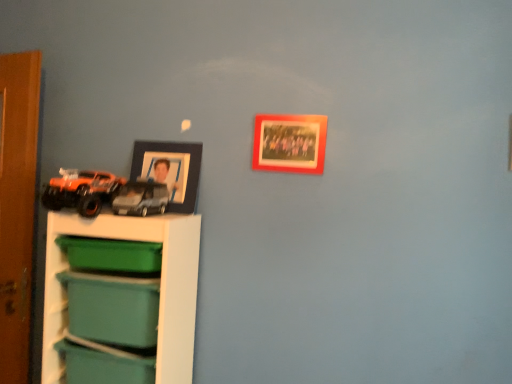
Question: From a real-world perspective, is teal plastic storage box at lower left, the 1th storage box ordered from the bottom, positioned over matte green plastic storage box at lower left, the 2th storage box when ordered from bottom to top, based on gravity?

Choices:
 (A) yes
 (B) no

Answer: (B)

Question: Is teal plastic storage box at lower left, which is counted as the third storage box, starting from the top, smaller than matte green plastic storage box at lower left, the 2th storage box positioned from the top?

Choices:
 (A) yes
 (B) no

Answer: (A)

Question: Is the position of teal plastic storage box at lower left, the 1th storage box ordered from the bottom, less distant than that of matte green plastic storage box at lower left, the 2th storage box positioned from the top?

Choices:
 (A) yes
 (B) no

Answer: (B)

Question: Is teal plastic storage box at lower left, which is counted as the third storage box, starting from the top, turned away from matte green plastic storage box at lower left, the 2th storage box positioned from the top?

Choices:
 (A) no
 (B) yes

Answer: (A)

Question: From a real-world perspective, does teal plastic storage box at lower left, the 1th storage box ordered from the bottom, sit lower than matte green plastic storage box at lower left, the 2th storage box positioned from the top?

Choices:
 (A) no
 (B) yes

Answer: (B)

Question: From the image's perspective, does teal plastic storage box at lower left, which is counted as the third storage box, starting from the top, appear lower than matte green plastic storage box at lower left, the 2th storage box positioned from the top?

Choices:
 (A) no
 (B) yes

Answer: (B)

Question: Is white plastic shelf at lower left directly adjacent to wooden photo frame at upper center, acting as the first picture frame starting from the right?

Choices:
 (A) no
 (B) yes

Answer: (A)

Question: Can you confirm if white plastic shelf at lower left is shorter than wooden photo frame at upper center, the 2th picture frame from the back?

Choices:
 (A) no
 (B) yes

Answer: (A)

Question: Is white plastic shelf at lower left oriented away from wooden photo frame at upper center, the 2th picture frame from the back?

Choices:
 (A) yes
 (B) no

Answer: (B)

Question: From the image's perspective, is white plastic shelf at lower left above wooden photo frame at upper center, which is the 2th picture frame in left-to-right order?

Choices:
 (A) yes
 (B) no

Answer: (B)

Question: From the image's perspective, is white plastic shelf at lower left located beneath wooden photo frame at upper center, acting as the first picture frame starting from the right?

Choices:
 (A) no
 (B) yes

Answer: (B)

Question: Considering the relative positions of white plastic shelf at lower left and wooden photo frame at upper center, acting as the first picture frame starting from the right, in the image provided, is white plastic shelf at lower left to the left of wooden photo frame at upper center, acting as the first picture frame starting from the right, from the viewer's perspective?

Choices:
 (A) yes
 (B) no

Answer: (A)

Question: Is black matte picture frame at upper left, the 2th picture frame in the right-to-left sequence, not close to orange matte truck at left, arranged as the 2th toy when viewed from the right?

Choices:
 (A) yes
 (B) no

Answer: (B)